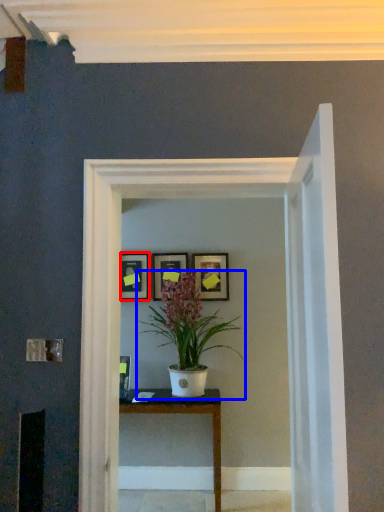
Question: Which point is closer to the camera, picture frame (highlighted by a red box) or houseplant (highlighted by a blue box)?

Choices:
 (A) picture frame
 (B) houseplant

Answer: (B)